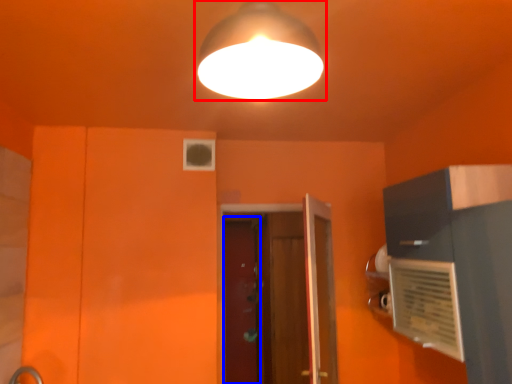
Question: Which object is further to the camera taking this photo, lamp (highlighted by a red box) or screen door (highlighted by a blue box)?

Choices:
 (A) lamp
 (B) screen door

Answer: (B)